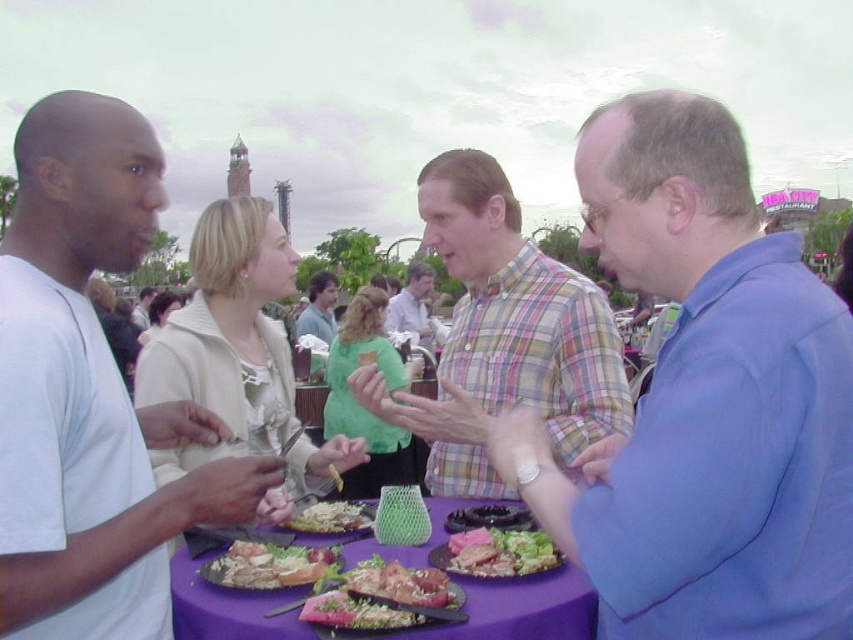
You are at a gathering and want to grab a piece of bread. The white crumbly bread at center is located at point (331,516). Where should you go to find it?

The white crumbly bread at center is located at point (331,516), so you should go to that coordinate to find it.

You are standing at the edge of the gathering and want to move towards the two points marked in the image. Which point, point [375,592] or point [378,616], will you reach first?

You will reach point [375,592] first because it is closer to you than point [378,616], which is further away.